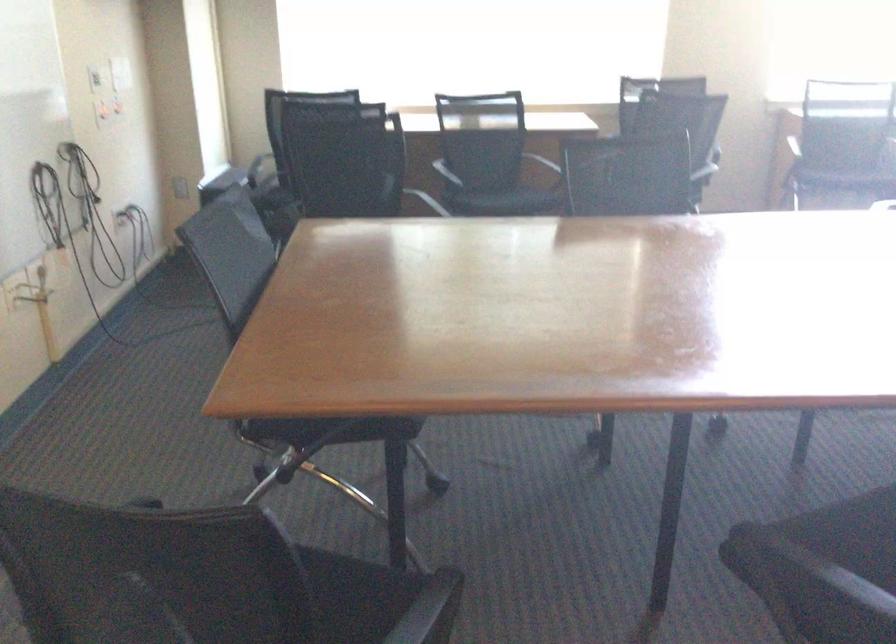
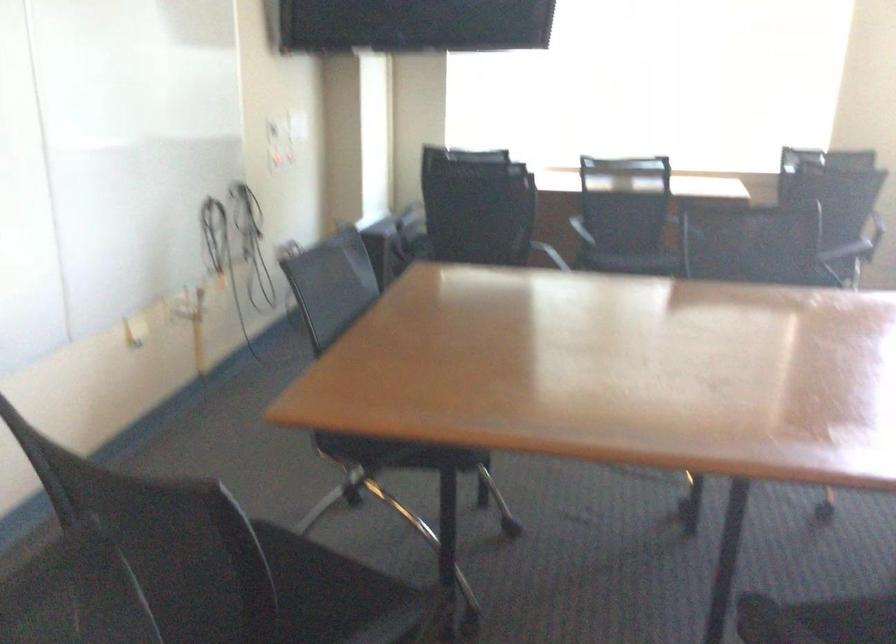
Locate, in the second image, the point that corresponds to point (816, 527) in the first image.

(849, 619)